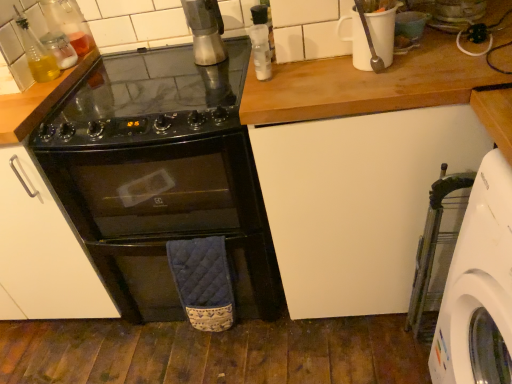
Locate an element on the screen. The width and height of the screenshot is (512, 384). vacant area that lies in front of translucent glass bottle at upper left, positioned as the second bottle in left-to-right order is located at coordinates (27, 89).